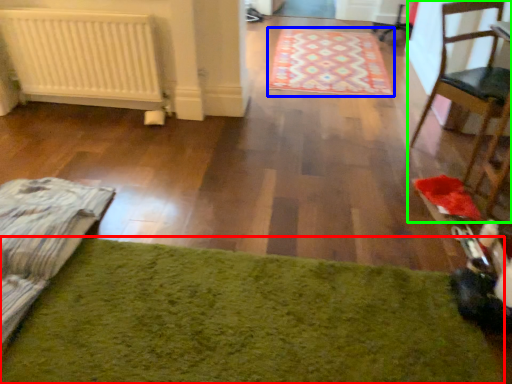
Question: Which object is the farthest from mat (highlighted by a red box)? Choose among these: mat (highlighted by a blue box) or chair (highlighted by a green box).

Choices:
 (A) mat
 (B) chair

Answer: (A)